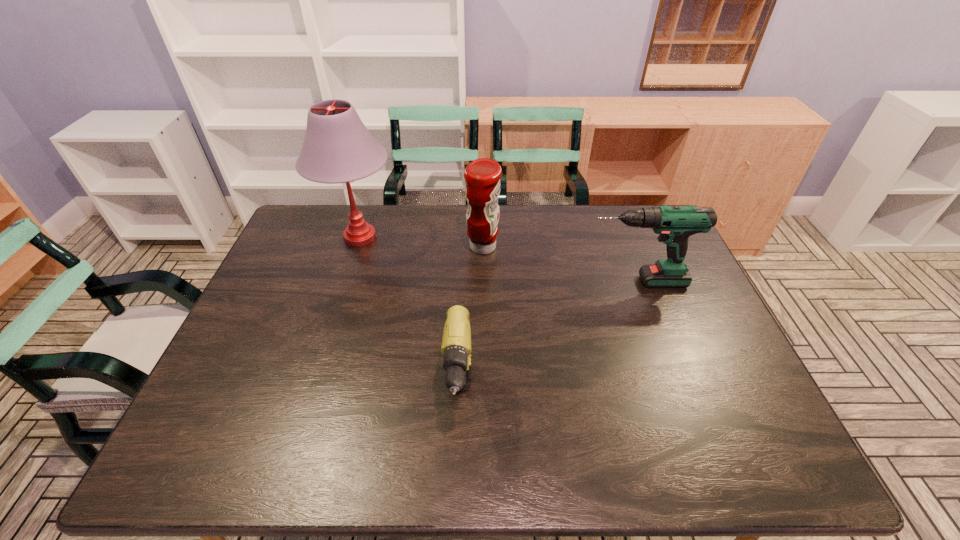
Identify the location of the leftmost object. Image resolution: width=960 pixels, height=540 pixels. point(338,148).

Locate an element on the screen. table lamp is located at coordinates [338, 148].

The height and width of the screenshot is (540, 960). Find the location of `condiment`. condiment is located at coordinates (482, 176).

The image size is (960, 540). In order to click on the farther drill in this screenshot , I will do `click(675, 224)`.

Find the location of a particular element. the right drill is located at coordinates coord(675,224).

Image resolution: width=960 pixels, height=540 pixels. Find the location of `the nearer drill`. the nearer drill is located at coordinates (456, 342).

You are a GUI agent. You are given a task and a screenshot of the screen. Output one action in this format:
    pyautogui.click(x=<x>, y=<y>)
    Task: Click on the nearest object
    
    Given the screenshot: What is the action you would take?
    pyautogui.click(x=456, y=342)

Where is `free space located on the front-facing side of the table lamp`? free space located on the front-facing side of the table lamp is located at coordinates (502, 238).

You are a GUI agent. You are given a task and a screenshot of the screen. Output one action in this format:
    pyautogui.click(x=<x>, y=<y>)
    Task: Click on the free region located 0.050m on the front of the condiment
    
    Given the screenshot: What is the action you would take?
    pyautogui.click(x=483, y=273)

This screenshot has height=540, width=960. In order to click on vacant space situated on the handle side of the rightmost object in this screenshot , I will do `click(467, 281)`.